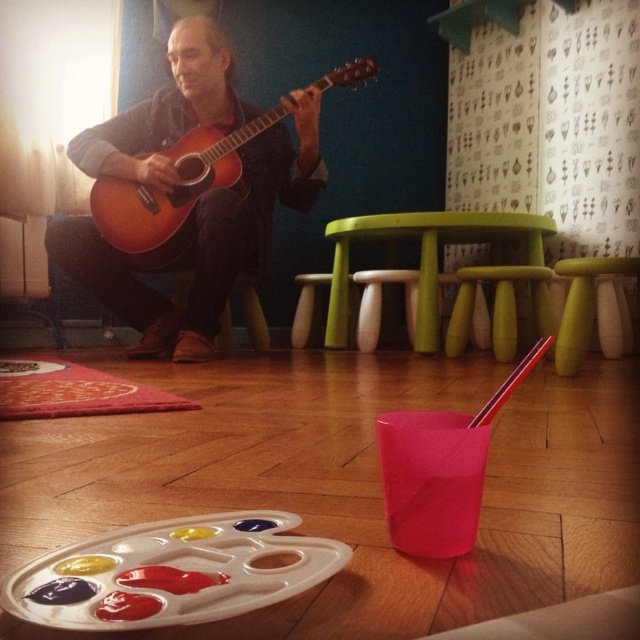
You are a visitor in this room and want to place a rectangular box that is 1.2 meters wide between the matte brown guitar at center and the green plastic stool at center. Can the box fit between them?

The matte brown guitar at center is wider than the green plastic stool at center. Since the box is 1.2 meters wide, it depends on the combined width of both objects. However, the description only states the guitar is wider than the stool but does not provide exact measurements. Without knowing the exact widths of both objects, it is impossible to determine if the 1.2 meter box will fit between them.

You are a visitor in this room and want to sit down to listen to the guitar. Which object, the matte brown guitar at center or the green plastic stool at center, should you sit on?

The green plastic stool at center is the object you should sit on because the matte brown guitar at center is located above it and likely not meant for sitting.